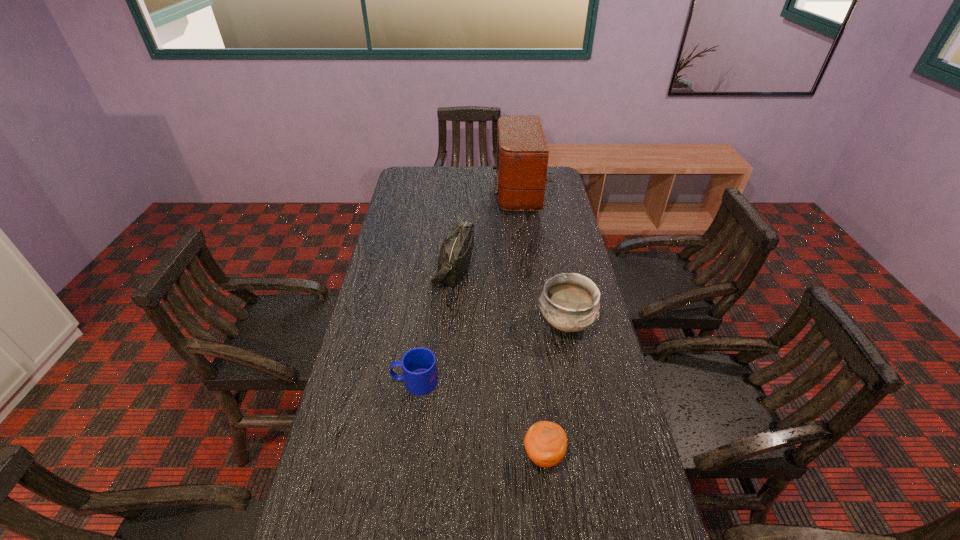
Find the location of a particular element. blank space located 0.290m on the front panel of the radio receiver is located at coordinates (429, 193).

At what (x,y) coordinates should I click in order to perform the action: click on free point located 0.050m on the front panel of the radio receiver. Please return your answer as a coordinate pair (x, y). Looking at the image, I should click on (482, 193).

Locate an element on the screen. vacant space located at the front padded panel of the second farthest object is located at coordinates (505, 268).

In order to click on vacant space situated 0.380m on the front of the pottery in this screenshot , I will do (595, 472).

Find the location of `vacant space located 0.210m on the back of the orange`. vacant space located 0.210m on the back of the orange is located at coordinates (534, 368).

Image resolution: width=960 pixels, height=540 pixels. In order to click on free space located 0.050m on the side with the handle of the mug in this screenshot , I will do `click(374, 382)`.

Image resolution: width=960 pixels, height=540 pixels. What are the coordinates of `vacant space positioned on the side with the handle of the mug` in the screenshot? It's located at (342, 382).

The image size is (960, 540). I want to click on blank area located 0.100m on the side with the handle of the mug, so click(356, 382).

This screenshot has height=540, width=960. What are the coordinates of `object situated at the far edge` in the screenshot? It's located at (522, 152).

Find the location of a particular element. The height and width of the screenshot is (540, 960). object at the left edge is located at coordinates point(418,364).